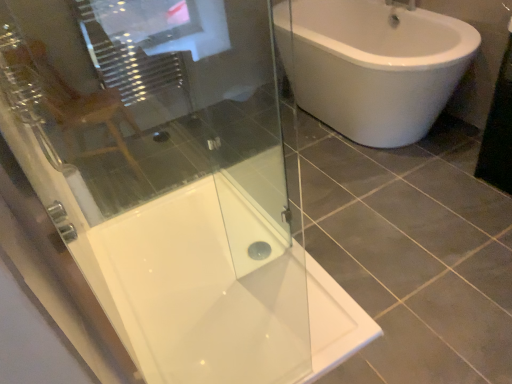
Locate an element on the screen. Image resolution: width=512 pixels, height=384 pixels. vacant area located to the right-hand side of matte wooden chair at upper left is located at coordinates (175, 153).